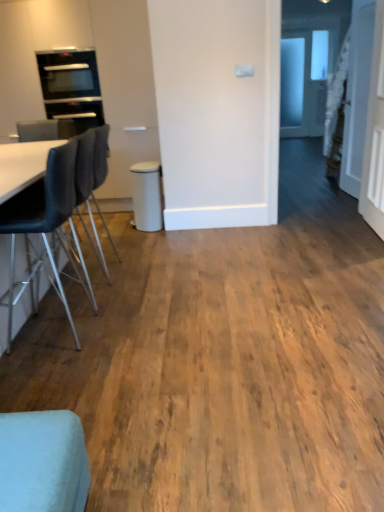
Image resolution: width=384 pixels, height=512 pixels. I want to click on free space in front of black leather chair at left, which is the second chair from back to front, so click(61, 372).